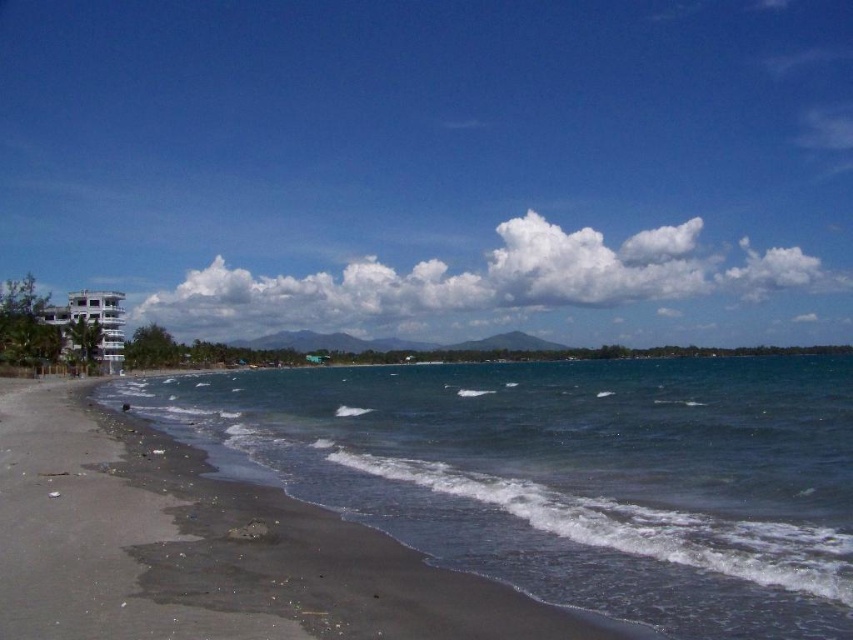
You are standing on the beach and want to take a photo of the white glossy building at left. To avoid the dark blue water at lower left from blocking the view, where should you position yourself relative to the building?

You should position yourself to the right of the white glossy building at left so that the dark blue water at lower left does not block the view.

You are standing on the beach and see two points marked in the image. The first point is at coordinates point (573,532) and the second point is at point (334,304). Which point is closer to you?

Point (573,532) is in front of point (334,304), so the first point is closer to you.